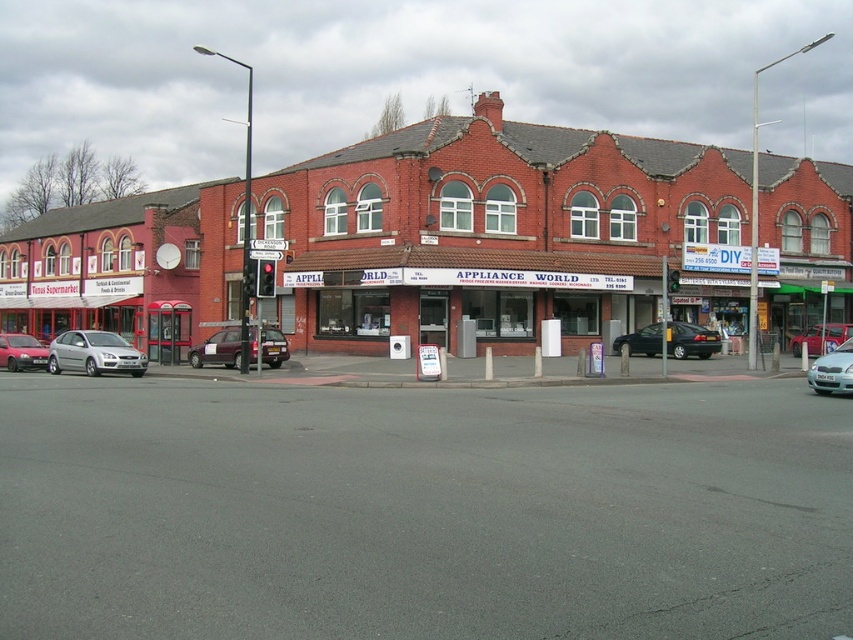
You are a delivery driver who needs to park your metallic purple van at center in a spot that is 0.547 units in the x direction and 0.256 units in the y direction. Is the parking spot at point (218,349) available?

The parking spot at point (218,349) is occupied by the metallic purple van at center, so it is not available.

You are a pedestrian waiting at the crosswalk near the traffic light. You notice a metallic purple van at center and a metallic silver car at center. Which vehicle is blocking your view of the other?

The metallic purple van at center is positioned under the metallic silver car at center, so the metallic silver car at center is blocking the view of the metallic purple van at center.

You are a pedestrian standing at the traffic light on the left side of the street. You need to cross the street to reach the DIY store. There is a metallic purple van at center and a metallic silver car at center blocking your path. Can you safely walk between them to cross the street?

The distance between the metallic purple van at center and the metallic silver car at center is 22.66 meters, so yes, you can safely walk between them to cross the street since the gap is wide enough for a pedestrian.